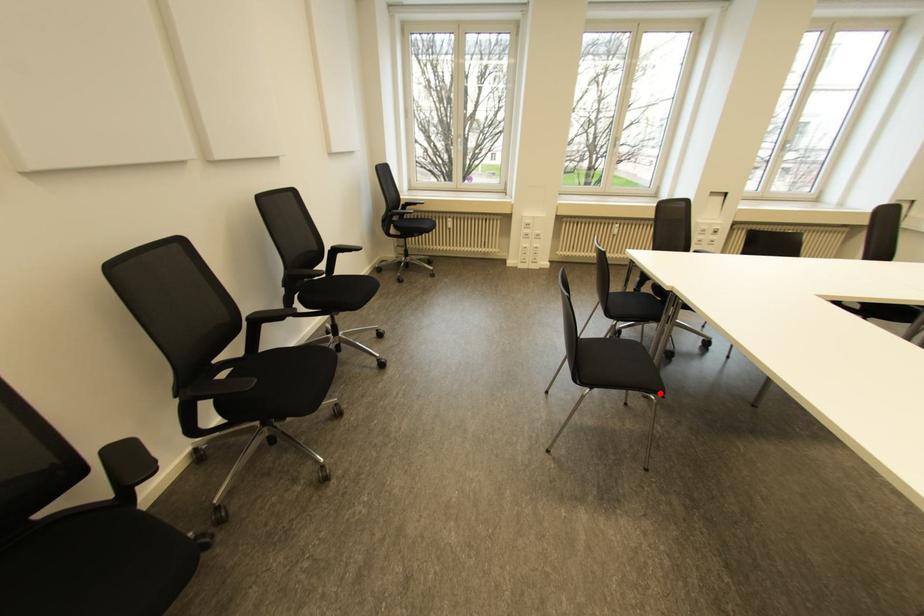
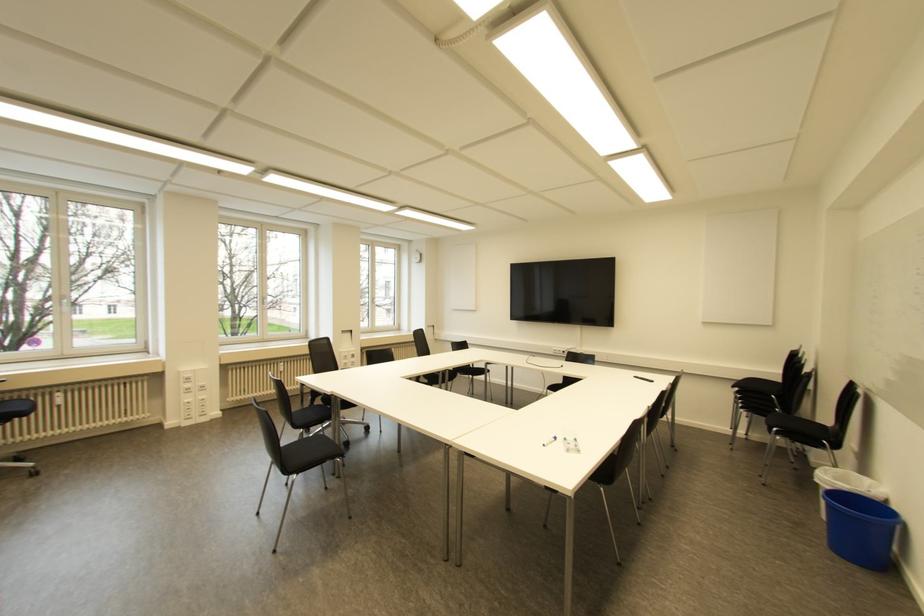
In the second image, find the point that corresponds to the highlighted location in the first image.

(342, 455)